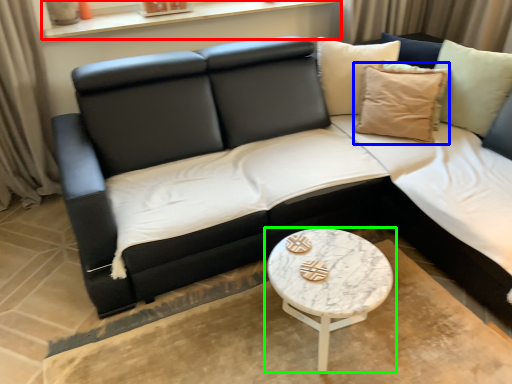
Question: Which is farther away from window sill (highlighted by a red box)? pillow (highlighted by a blue box) or coffee table (highlighted by a green box)?

Choices:
 (A) pillow
 (B) coffee table

Answer: (B)